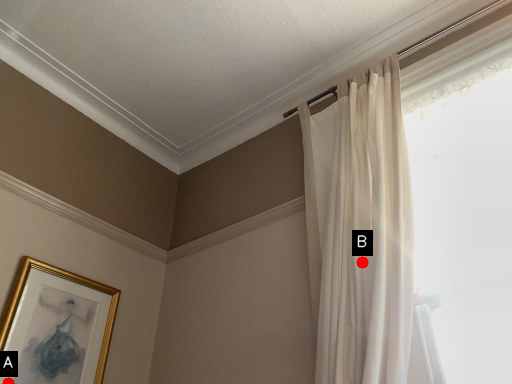
Question: Two points are circled on the image, labeled by A and B beside each circle. Among these points, which one is nearest to the camera?

Choices:
 (A) A is closer
 (B) B is closer

Answer: (B)